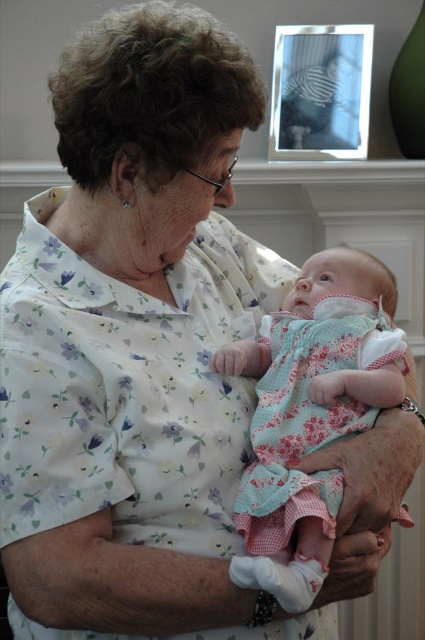
Question: Considering the relative positions of floral fabric baby at center and metallic silver picture frame at upper center in the image provided, where is floral fabric baby at center located with respect to metallic silver picture frame at upper center?

Choices:
 (A) right
 (B) left

Answer: (B)

Question: Is floral fabric baby at center in front of metallic silver picture frame at upper center?

Choices:
 (A) no
 (B) yes

Answer: (B)

Question: Is floral fabric baby at center behind metallic silver picture frame at upper center?

Choices:
 (A) no
 (B) yes

Answer: (A)

Question: Which object appears farthest from the camera in this image?

Choices:
 (A) metallic silver picture frame at upper center
 (B) floral fabric baby at center

Answer: (A)